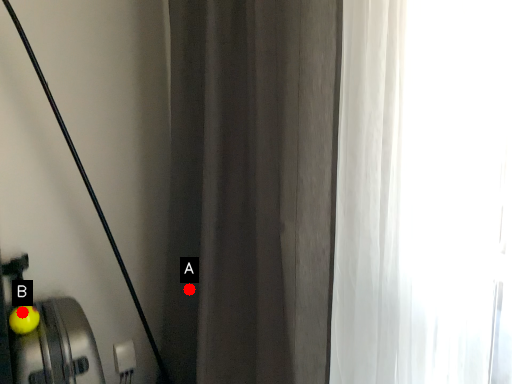
Question: Two points are circled on the image, labeled by A and B beside each circle. Among these points, which one is nearest to the camera?

Choices:
 (A) A is closer
 (B) B is closer

Answer: (B)